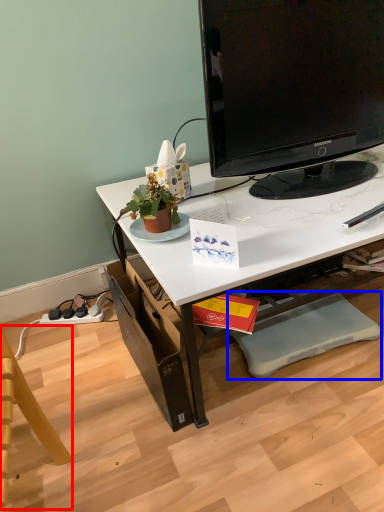
Question: Which object is closer to the camera taking this photo, swivel chair (highlighted by a red box) or footrest (highlighted by a blue box)?

Choices:
 (A) swivel chair
 (B) footrest

Answer: (A)